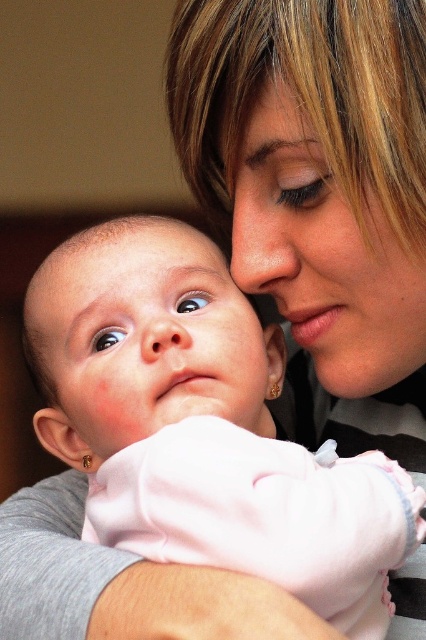
In the scene where a woman and a baby are interacting, you notice two pink items at the center of the image. One is labeled as the pink fabric baby at center and the other is the pink fabric at center. Which of these two items is larger in size?

The pink fabric baby at center is bigger than the pink fabric at center.

You are a photographer who wants to ensure both the pink fabric baby at center and the pink fabric at center are fully visible in the photo. Which object should you adjust the camera angle to focus on first to accommodate their sizes?

The pink fabric baby at center is wider than the pink fabric at center, so you should adjust the camera angle to focus on the pink fabric baby at center first to ensure it fits properly before considering the other object.